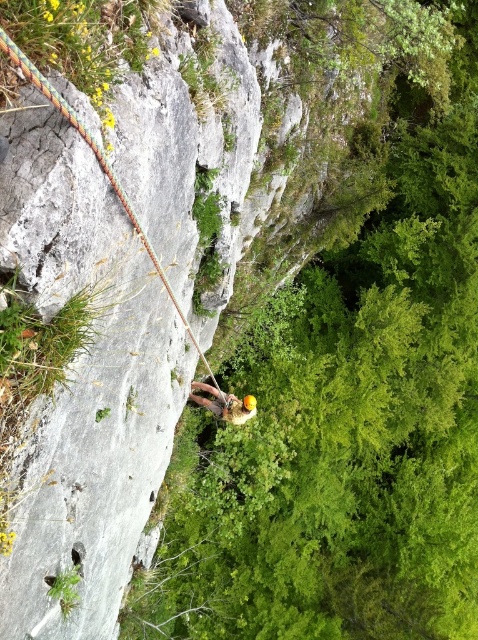
Is multicolored braided rope at left below yellow helmet at center?

Incorrect, multicolored braided rope at left is not positioned below yellow helmet at center.

Looking at this image, who is taller, multicolored braided rope at left or yellow helmet at center?

Standing taller between the two is multicolored braided rope at left.

Does point (161, 280) lie behind point (237, 424)?

No.

You are a GUI agent. You are given a task and a screenshot of the screen. Output one action in this format:
    pyautogui.click(x=<x>, y=<y>)
    Task: Click on the multicolored braided rope at left
    This screenshot has width=478, height=640.
    Given the screenshot: What is the action you would take?
    pyautogui.click(x=99, y=164)